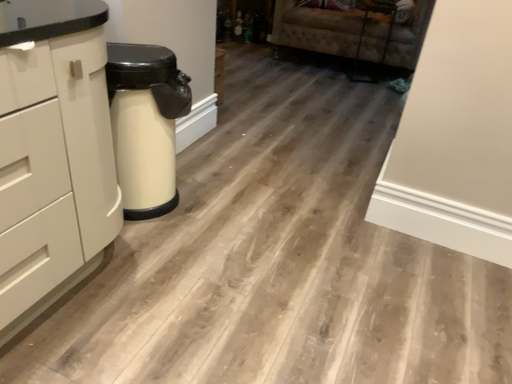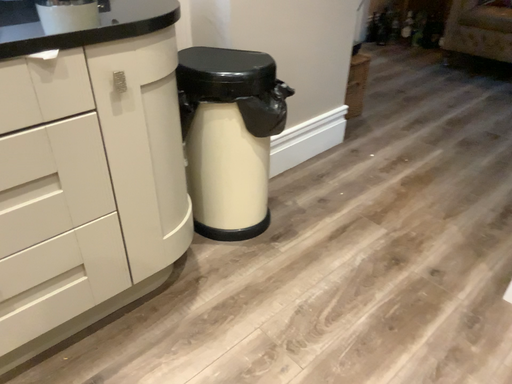
Question: How did the camera likely rotate when shooting the video?

Choices:
 (A) rotated left
 (B) rotated right

Answer: (A)